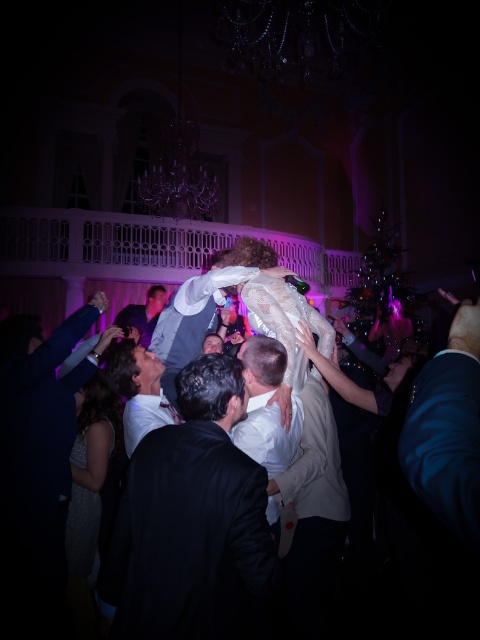
Question: Which is nearer to the satin silver dress at lower left?

Choices:
 (A) white satin dress at center
 (B) dark suit at center
 (C) white shirt at center
 (D) dark blue suit at lower left

Answer: (D)

Question: Estimate the real-world distances between objects in this image. Which object is farther from the lace dress at center?

Choices:
 (A) white satin dress at center
 (B) white satin shirt at center
 (C) dark blue suit at lower left

Answer: (C)

Question: Which point is farther to the camera?

Choices:
 (A) (230, 579)
 (B) (277, 388)
 (C) (121, 374)
 (D) (468, 456)

Answer: (C)

Question: Can you confirm if white satin shirt at center is positioned below white shirt at center?

Choices:
 (A) yes
 (B) no

Answer: (A)

Question: From the image, what is the correct spatial relationship of dark suit at center in relation to dark blue suit at lower left?

Choices:
 (A) left
 (B) right

Answer: (B)

Question: Does white satin shirt at center appear under satin silver dress at lower left?

Choices:
 (A) no
 (B) yes

Answer: (A)